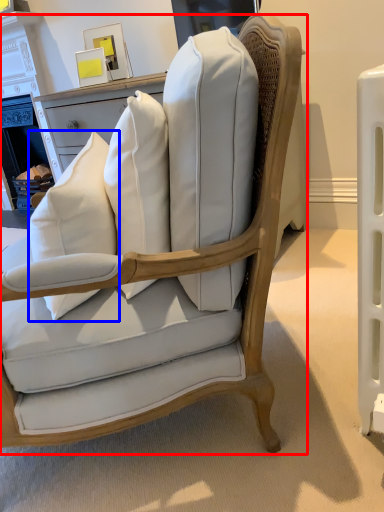
Question: Which object appears farthest to the camera in this image, chair (highlighted by a red box) or throw pillow (highlighted by a blue box)?

Choices:
 (A) chair
 (B) throw pillow

Answer: (B)